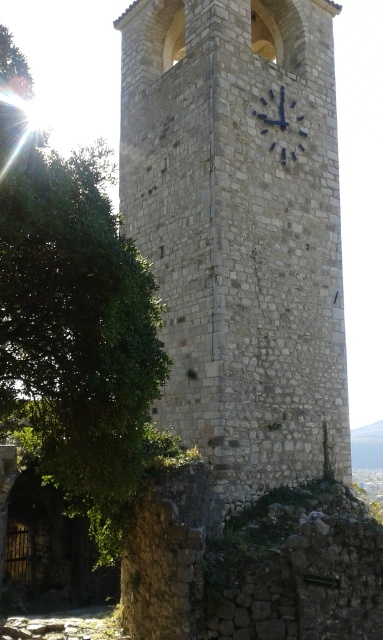
Is the position of white stone clock tower at center less distant than that of green leafy tree at left?

No, white stone clock tower at center is behind green leafy tree at left.

Measure the distance between white stone clock tower at center and camera.

white stone clock tower at center is 37.40 meters away from camera.

Is point (327, 36) positioned behind point (26, 416)?

That is True.

Where is `white stone clock tower at center`? Image resolution: width=383 pixels, height=640 pixels. white stone clock tower at center is located at coordinates (240, 230).

How much distance is there between green leafy tree at left and blue metallic clock at upper center?

green leafy tree at left is 71.30 feet from blue metallic clock at upper center.

Is point (4, 262) closer to camera compared to point (270, 92)?

Yes, it is in front of point (270, 92).

The width and height of the screenshot is (383, 640). Find the location of `green leafy tree at left`. green leafy tree at left is located at coordinates (75, 326).

Is white stone clock tower at center closer to the viewer compared to blue metallic clock at upper center?

Yes, it is.

Does white stone clock tower at center have a greater width compared to blue metallic clock at upper center?

Yes, white stone clock tower at center is wider than blue metallic clock at upper center.

Identify the location of white stone clock tower at center. This screenshot has width=383, height=640. pyautogui.click(x=240, y=230).

Where is `white stone clock tower at center`? The width and height of the screenshot is (383, 640). white stone clock tower at center is located at coordinates (240, 230).